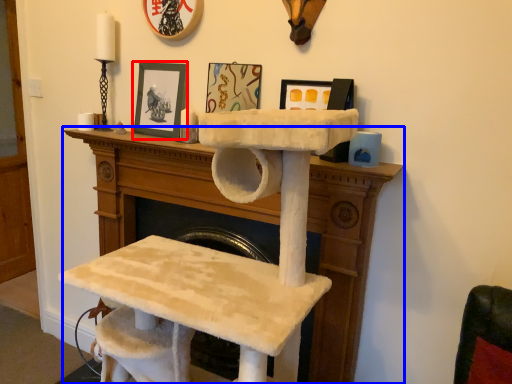
Question: Which point is closer to the camera, picture frame (highlighted by a red box) or furniture (highlighted by a blue box)?

Choices:
 (A) picture frame
 (B) furniture

Answer: (B)